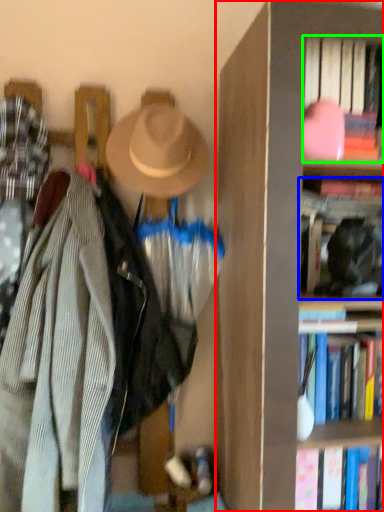
Question: Which object is positioned closest to bookcase (highlighted by a red box)? Select from book (highlighted by a blue box) and book (highlighted by a green box).

Choices:
 (A) book
 (B) book

Answer: (B)